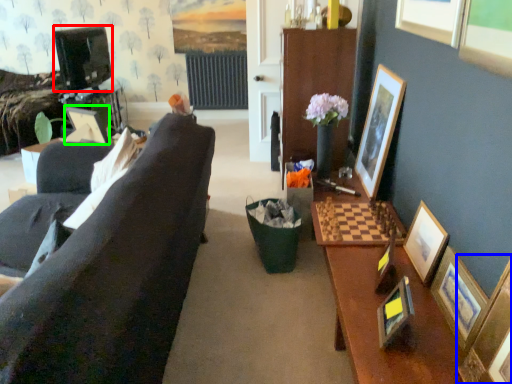
Question: Estimate the real-world distances between objects in this image. Which object is closer to television (highlighted by a red box), picture frame (highlighted by a blue box) or picture frame (highlighted by a green box)?

Choices:
 (A) picture frame
 (B) picture frame

Answer: (B)